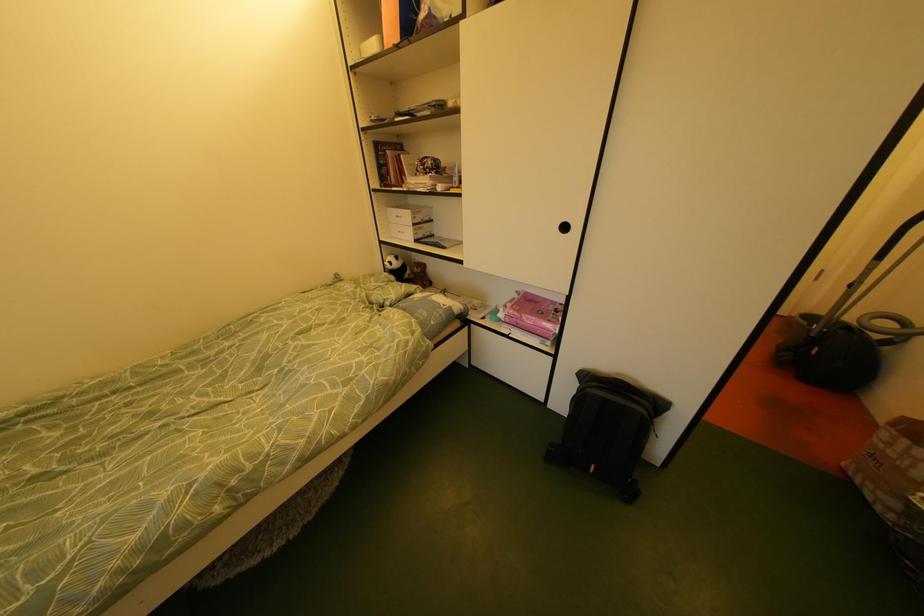
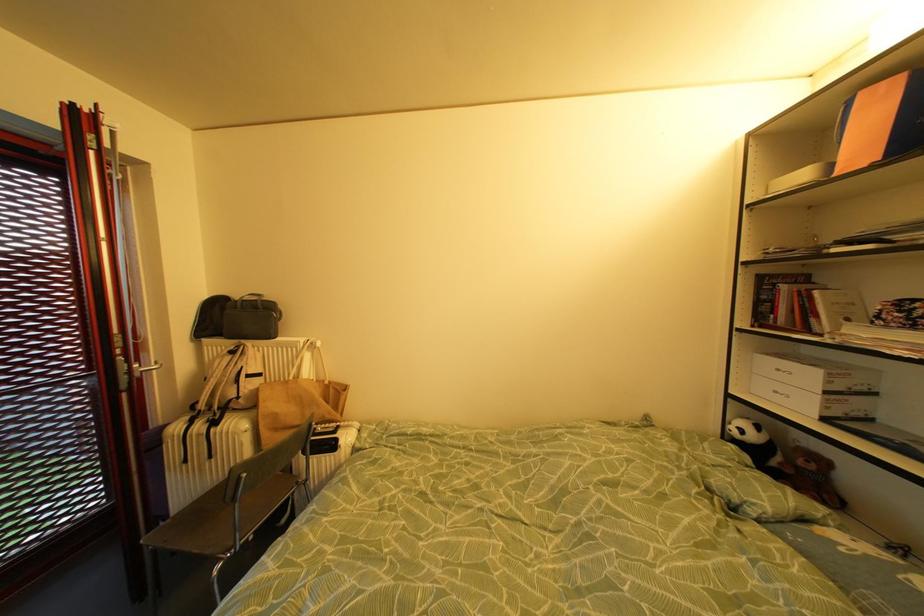
Question: How did the camera likely rotate?

Choices:
 (A) Left
 (B) Right
 (C) Up
 (D) Down

Answer: (A)